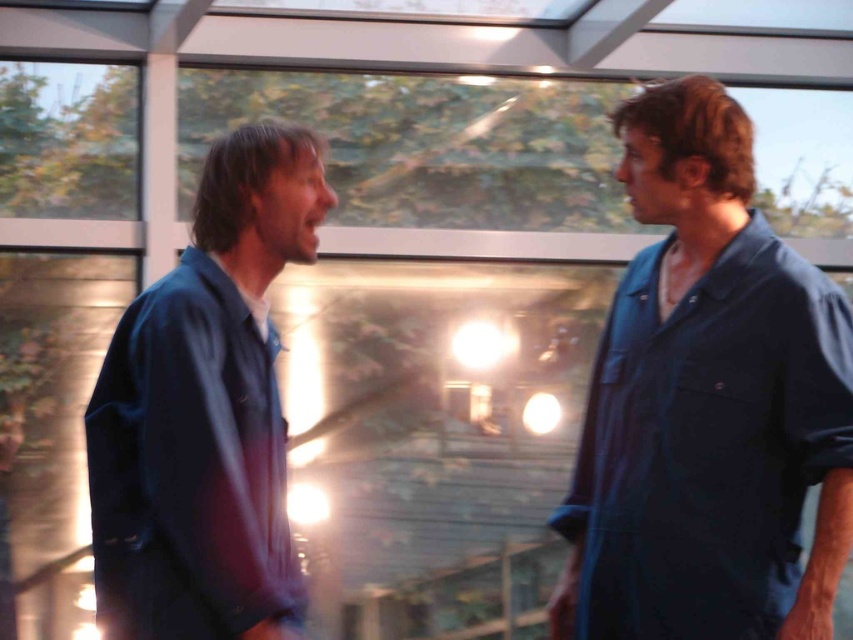
Question: Can you confirm if dark blue shirt at right is wider than blue cotton shirt at left?

Choices:
 (A) no
 (B) yes

Answer: (B)

Question: Is dark blue shirt at right wider than blue cotton shirt at left?

Choices:
 (A) yes
 (B) no

Answer: (A)

Question: Which of the following is the closest to the observer?

Choices:
 (A) blue cotton shirt at left
 (B) dark blue shirt at right

Answer: (A)

Question: Is dark blue shirt at right to the right of blue cotton shirt at left from the viewer's perspective?

Choices:
 (A) yes
 (B) no

Answer: (A)